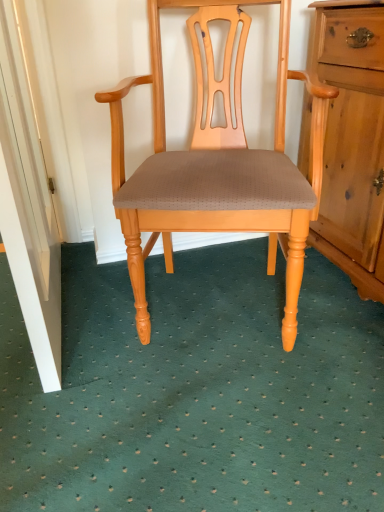
Locate an element on the screen. The height and width of the screenshot is (512, 384). vacant space underneath white painted wood door at lower left (from a real-world perspective) is located at coordinates (71, 311).